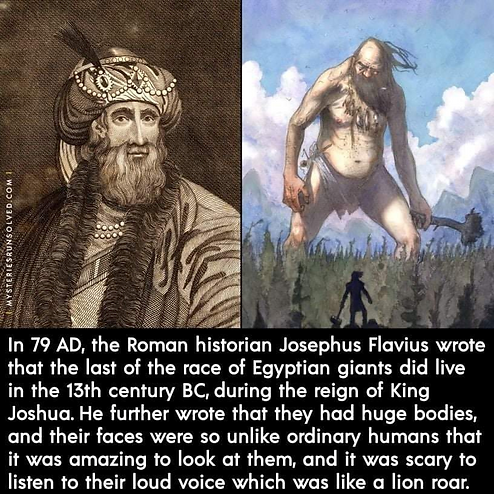
The height and width of the screenshot is (494, 494). I want to click on panel, so click(x=254, y=67), click(x=229, y=181).